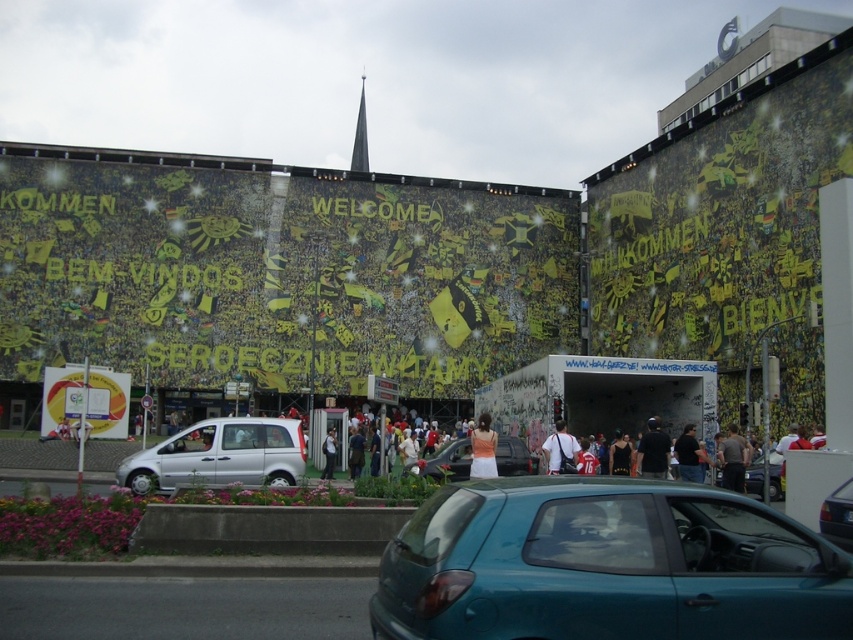
Question: Estimate the real-world distances between objects in this image. Which object is closer to the matte orange dress at center?

Choices:
 (A) teal glossy hatchback at center
 (B) dark gray shirt at center
 (C) silver metallic van at center

Answer: (B)

Question: Estimate the real-world distances between objects in this image. Which object is closer to the silver metallic van at center?

Choices:
 (A) matte orange dress at center
 (B) brown leather jacket at center
 (C) metallic silver car at center
 (D) white fabric bag at center

Answer: (A)

Question: Is teal glossy hatchback at center closer to camera compared to white fabric bag at center?

Choices:
 (A) yes
 (B) no

Answer: (A)

Question: Where is matte orange dress at center located in relation to white fabric bag at center in the image?

Choices:
 (A) below
 (B) above

Answer: (A)

Question: Among these points, which one is nearest to the camera?

Choices:
 (A) (544, 449)
 (B) (646, 460)

Answer: (B)

Question: Is silver metallic van at center below metallic silver car at center?

Choices:
 (A) yes
 (B) no

Answer: (B)